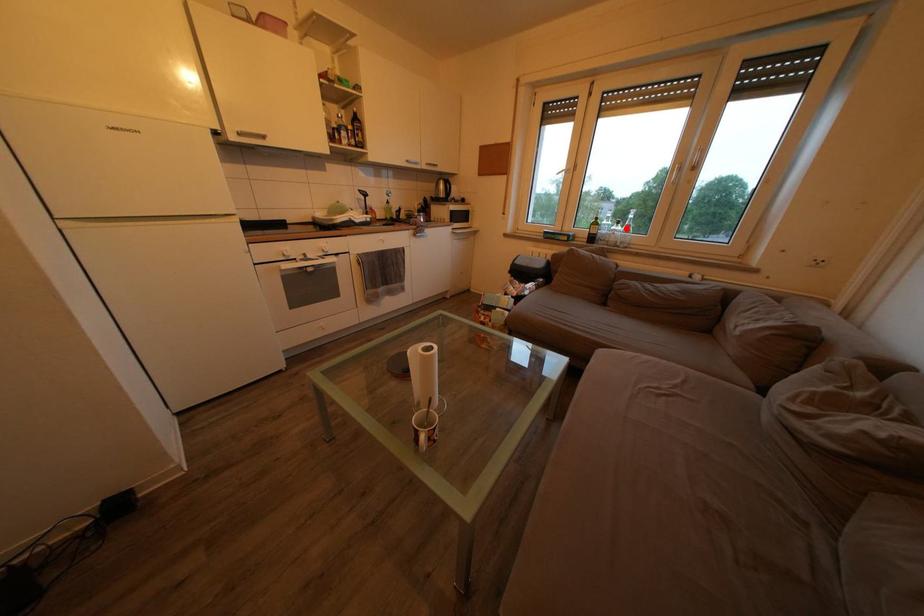
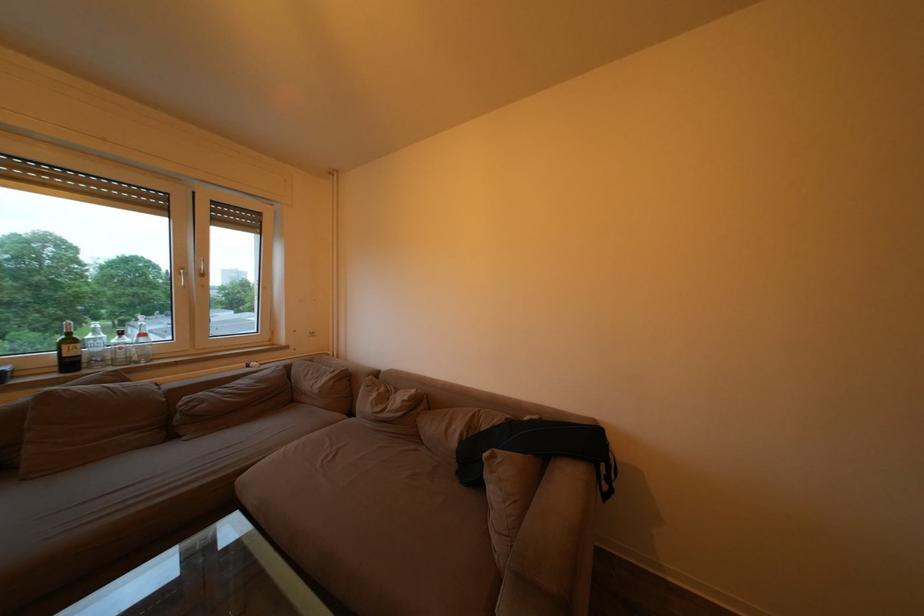
Question: I am providing you with two images of the same scene from different viewpoints. Given a red point in image1, look at the same physical point in image2. Is it:

Choices:
 (A) Closer to the viewpoint
 (B) Farther from the viewpoint

Answer: (B)